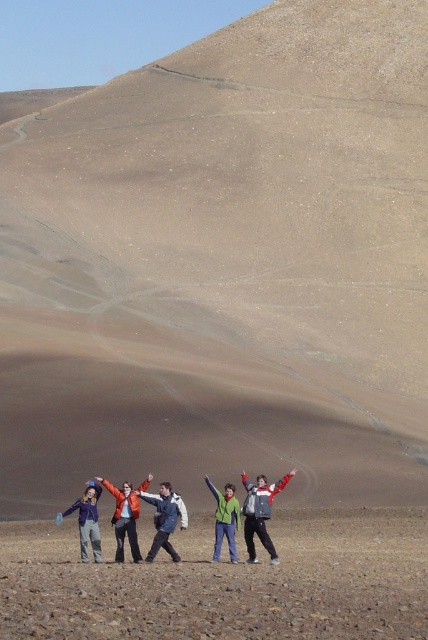
Consider the image. Does blue denim jacket at center appear on the right side of matte blue jacket at lower left?

Yes, blue denim jacket at center is to the right of matte blue jacket at lower left.

Who is taller, blue denim jacket at center or matte blue jacket at lower left?

matte blue jacket at lower left

Who is more distant from viewer, (151, 548) or (95, 502)?

Positioned behind is point (95, 502).

Locate an element on the screen. blue denim jacket at center is located at coordinates (165, 518).

Between orange jacket at center and matte black jacket at lower left, which one is positioned lower?

orange jacket at center is below.

What are the coordinates of `orange jacket at center` in the screenshot? It's located at (124, 518).

Is point (131, 515) farther from camera compared to point (95, 477)?

No, (131, 515) is in front of (95, 477).

You are a GUI agent. You are given a task and a screenshot of the screen. Output one action in this format:
    pyautogui.click(x=<x>, y=<y>)
    Task: Click on the orange jacket at center
    The height and width of the screenshot is (640, 428).
    Given the screenshot: What is the action you would take?
    pyautogui.click(x=124, y=518)

Is point (61, 518) positioned before point (116, 497)?

No, it is behind (116, 497).

Between matte blue jacket at lower left and matte black jacket at lower left, which one has less height?

matte black jacket at lower left is shorter.

Between point (80, 502) and point (110, 486), which one is positioned behind?

Positioned behind is point (80, 502).

The width and height of the screenshot is (428, 640). In order to click on matte blue jacket at lower left in this screenshot , I will do `click(86, 520)`.